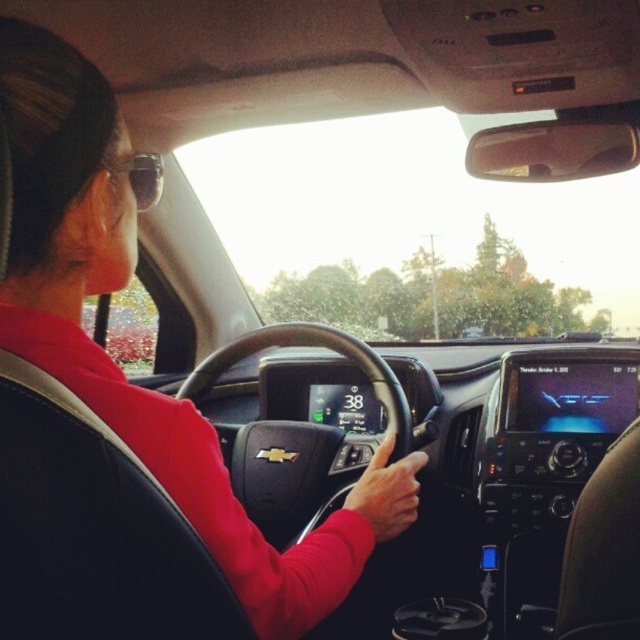
Question: Is black leather steering wheel at center in front of sunglasses at upper left?

Choices:
 (A) no
 (B) yes

Answer: (A)

Question: Can you confirm if black leather steering wheel at center is smaller than sunglasses at upper left?

Choices:
 (A) no
 (B) yes

Answer: (A)

Question: Is black leather steering wheel at center below sunglasses at upper left?

Choices:
 (A) yes
 (B) no

Answer: (A)

Question: Which point is farther from the camera taking this photo?

Choices:
 (A) (273, 328)
 (B) (148, 154)

Answer: (A)

Question: Which point is farther from the camera taking this photo?

Choices:
 (A) (394, 394)
 (B) (112, 173)

Answer: (A)